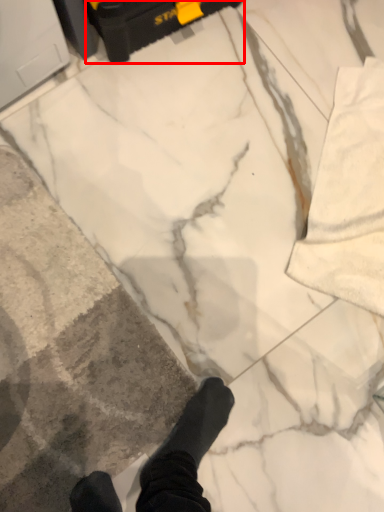
Question: From the image's perspective, considering the relative positions of equipment (annotated by the red box) and concrete in the image provided, where is equipment (annotated by the red box) located with respect to the staircase?

Choices:
 (A) above
 (B) below

Answer: (A)